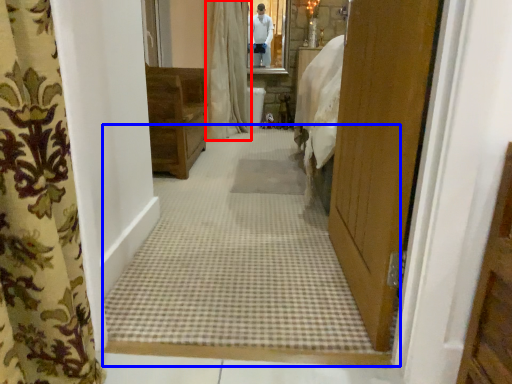
Question: Which object is closer to the camera taking this photo, curtain (highlighted by a red box) or plain (highlighted by a blue box)?

Choices:
 (A) curtain
 (B) plain

Answer: (B)